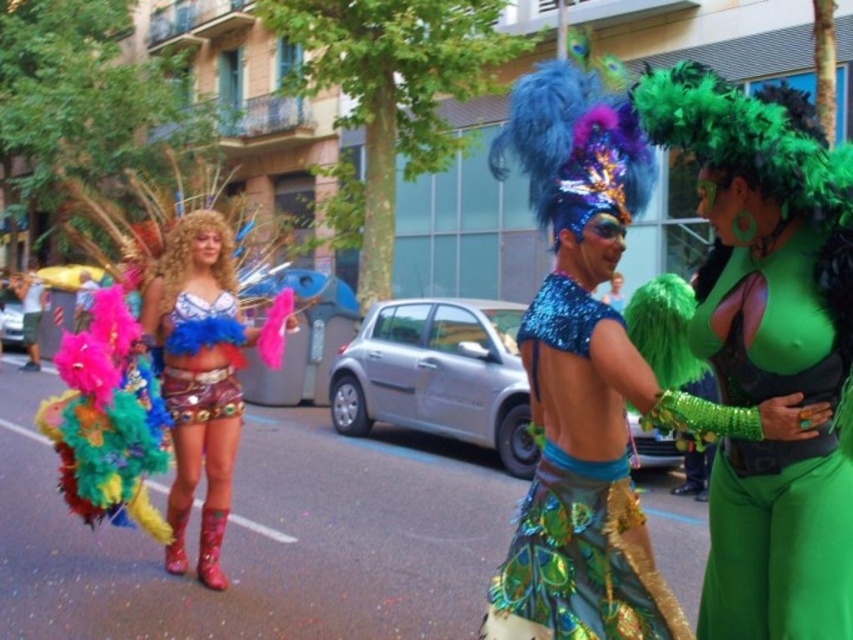
Locate an element on the screen. The height and width of the screenshot is (640, 853). green sequined top at center is located at coordinates (778, 541).

Does point (724, 513) come farther from viewer compared to point (178, 278)?

That is False.

Which is in front, point (811, 561) or point (210, 275)?

Positioned in front is point (811, 561).

This screenshot has height=640, width=853. In order to click on green sequined top at center in this screenshot , I will do `click(778, 541)`.

Does shiny blue sequin headdress at upper right have a greater width compared to shiny blue sequins at center?

Yes, shiny blue sequin headdress at upper right is wider than shiny blue sequins at center.

Does point (546, 554) come closer to viewer compared to point (604, 548)?

No, (546, 554) is behind (604, 548).

Who is more distant from viewer, (602, 452) or (659, 593)?

Point (602, 452)

Find the location of a particular element. shiny blue sequin headdress at upper right is located at coordinates (612, 378).

Between green sequined top at center and shiny metallic shorts at center, which one appears on the left side from the viewer's perspective?

shiny metallic shorts at center is more to the left.

Which is behind, point (776, 552) or point (195, 404)?

The point (195, 404) is behind.

Which is in front, point (740, 477) or point (236, 401)?

Point (740, 477)

Locate an element on the screen. This screenshot has height=640, width=853. green sequined top at center is located at coordinates (778, 541).